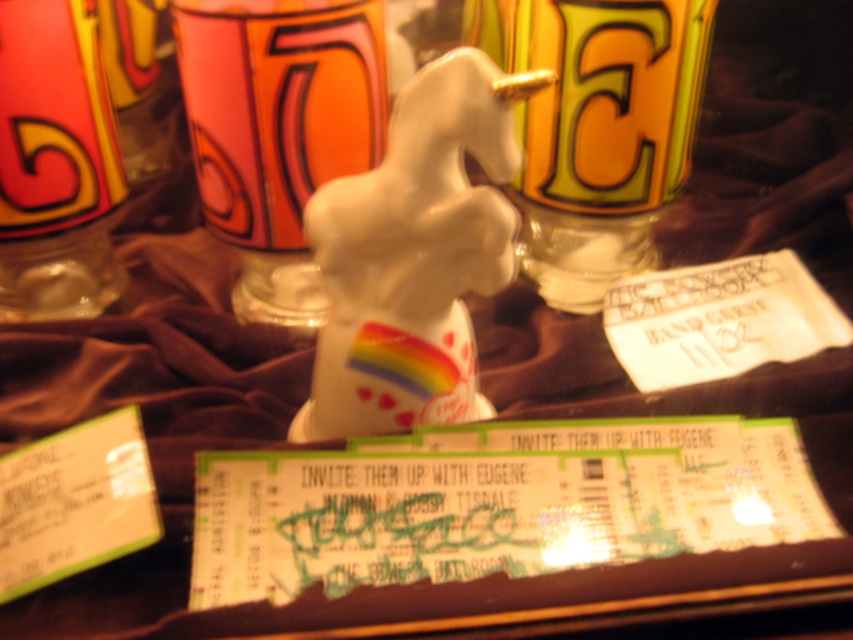
You are setting up a small table for a cozy evening. You have a matte ceramic mug at center and a translucent glass bottle at left. If you want to place a decorative item between them, how far apart should you position the mug and bottle?

The distance between the matte ceramic mug at center and the translucent glass bottle at left is 7.61 inches. To place a decorative item between them, you should keep the mug and bottle at least 7.61 inches apart.

You are organizing a small party and need to place a drink on the table. There is a matte ceramic mug at center and a translucent glass bottle at left. Which one should you choose if you want the drink to be more visible to guests sitting across the table?

The translucent glass bottle at left is more visible to guests sitting across the table because it allows light to pass through, making its contents and shape more noticeable compared to the matte ceramic mug at center.